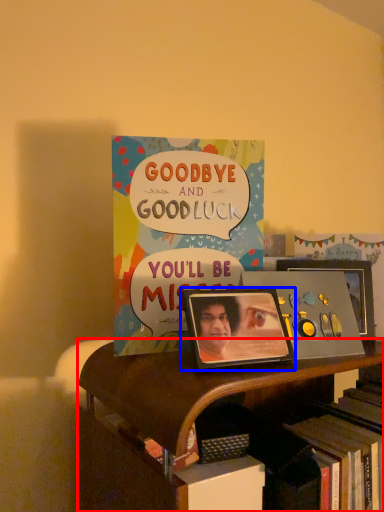
Question: Which object is closer to the camera taking this photo, bookcase (highlighted by a red box) or picture frame (highlighted by a blue box)?

Choices:
 (A) bookcase
 (B) picture frame

Answer: (A)